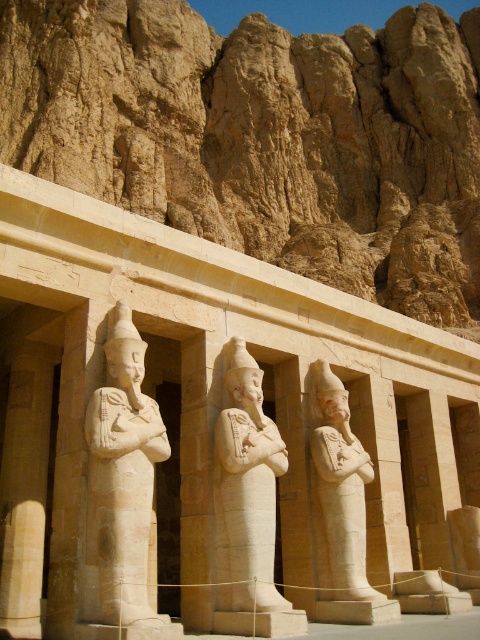
You are an archaeologist examining the Mortuary Temple of Hatshepsut. You notice the beige stone rock formation at upper center and the smooth beige statue at center. Which object is located above the other?

The beige stone rock formation at upper center is positioned over the smooth beige statue at center, meaning it is above the statue.